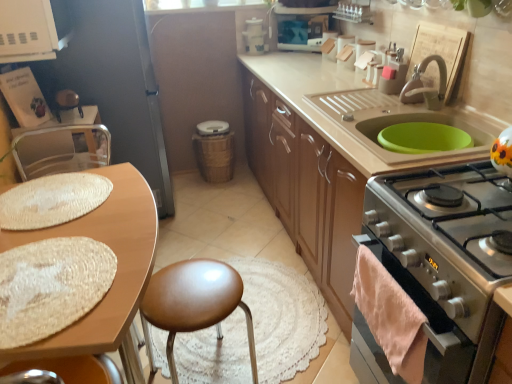
What do you see at coordinates (214, 150) in the screenshot? I see `woven brown trash can at center, arranged as the second appliance when viewed from the top` at bounding box center [214, 150].

Find the location of a particular element. This screenshot has height=384, width=512. matte wood cabinets at center is located at coordinates [321, 111].

Can you confirm if metallic silver chair at left is smaller than white plastic container at upper center, which is the first appliance in top-to-bottom order?

No, metallic silver chair at left is not smaller than white plastic container at upper center, which is the first appliance in top-to-bottom order.

Considering the relative positions of metallic silver chair at left and white plastic container at upper center, which is the first appliance in top-to-bottom order, in the image provided, is metallic silver chair at left to the right of white plastic container at upper center, which is the first appliance in top-to-bottom order, from the viewer's perspective?

No, metallic silver chair at left is not to the right of white plastic container at upper center, which is the first appliance in top-to-bottom order.

Based on the photo, is metallic silver chair at left aimed at white plastic container at upper center, which is the 1th appliance in right-to-left order?

No, metallic silver chair at left is not oriented towards white plastic container at upper center, which is the 1th appliance in right-to-left order.

Is metallic silver chair at left facing towards woven brown trash can at center, arranged as the second appliance when viewed from the top?

No, metallic silver chair at left does not turn towards woven brown trash can at center, arranged as the second appliance when viewed from the top.

Find the location of a particular element. appliance located underneath the metallic silver chair at left (from a real-world perspective) is located at coordinates (214, 150).

From a real-world perspective, is metallic silver chair at left above or below woven brown trash can at center, which appears as the second appliance when viewed from the front?

In terms of real-world spatial position, metallic silver chair at left is above woven brown trash can at center, which appears as the second appliance when viewed from the front.

Is metallic silver chair at left wider or thinner than woven brown trash can at center, arranged as the second appliance when viewed from the right?

metallic silver chair at left is thinner than woven brown trash can at center, arranged as the second appliance when viewed from the right.

Between point (426, 161) and point (248, 23), which one is positioned behind?

The point (248, 23) is farther from the camera.

From the matte wood cabinets at center, count 1st appliances backward and point to it. Please provide its 2D coordinates.

[(254, 37)]

Is matte wood cabinets at center outside of white plastic container at upper center, the 1th appliance in the front-to-back sequence?

That's correct, matte wood cabinets at center is outside of white plastic container at upper center, the 1th appliance in the front-to-back sequence.

Is matte wood cabinets at center in front of or behind white plastic container at upper center, which is counted as the second appliance, starting from the bottom, in the image?

In the image, matte wood cabinets at center appears in front of white plastic container at upper center, which is counted as the second appliance, starting from the bottom.

Find the location of a particular element. bar stool directly beneath the wooden table at left (from a real-world perspective) is located at coordinates (193, 303).

Does wooden table at left appear on the right side of brown leather stool at center?

No.

Is brown leather stool at center at the back of wooden table at left?

wooden table at left is not turned away from brown leather stool at center.

From the image's perspective, is wooden table at left located above matte wood cabinets at center?

Actually, wooden table at left appears below matte wood cabinets at center in the image.

From a real-world perspective, between wooden table at left and matte wood cabinets at center, who is vertically higher?

matte wood cabinets at center is physically above.

Is wooden table at left turned away from matte wood cabinets at center?

No, wooden table at left's orientation is not away from matte wood cabinets at center.

This screenshot has height=384, width=512. What are the coordinates of `table that is on the left side of matte wood cabinets at center` in the screenshot? It's located at (115, 276).

From a real-world perspective, is metallic silver chair at left under green rubber mat at upper right?

Yes, from a real-world perspective, metallic silver chair at left is beneath green rubber mat at upper right.

Considering the positions of objects metallic silver chair at left and green rubber mat at upper right in the image provided, who is in front, metallic silver chair at left or green rubber mat at upper right?

green rubber mat at upper right is more forward.

The height and width of the screenshot is (384, 512). Identify the location of sink that is above the metallic silver chair at left (from the image's perspective). (392, 122).

Can you confirm if metallic silver chair at left is positioned to the left of green rubber mat at upper right?

Yes.

From the image's perspective, does wooden table at left appear higher than satin silver oven at lower right?

Yes, from the image's perspective, wooden table at left is over satin silver oven at lower right.

Considering the relative sizes of wooden table at left and satin silver oven at lower right in the image provided, is wooden table at left bigger than satin silver oven at lower right?

Indeed, wooden table at left has a larger size compared to satin silver oven at lower right.

Can we say wooden table at left lies outside satin silver oven at lower right?

Yes, wooden table at left is located beyond the bounds of satin silver oven at lower right.

You are a GUI agent. You are given a task and a screenshot of the screen. Output one action in this format:
    pyautogui.click(x=<x>, y=<y>)
    Task: Click on the chair on the left of white plastic container at upper center, which is counted as the second appliance, starting from the bottom
    
    Given the screenshot: What is the action you would take?
    click(x=61, y=150)

This screenshot has width=512, height=384. Find the location of `appliance below the metallic silver chair at left (from a real-world perspective)`. appliance below the metallic silver chair at left (from a real-world perspective) is located at coordinates (214, 150).

Which object lies further to the anchor point satin silver oven at lower right, metallic silver chair at left or matte wood cabinets at center?

metallic silver chair at left is further to satin silver oven at lower right.

Looking at the image, which one is located further to green rubber mat at upper right, metallic silver chair at left or pink fluffy towel at lower right?

Based on the image, metallic silver chair at left appears to be further to green rubber mat at upper right.

Based on their spatial positions, is woven brown trash can at center, arranged as the second appliance when viewed from the right, or brown leather stool at center closer to pink fluffy towel at lower right?

Among the two, brown leather stool at center is located nearer to pink fluffy towel at lower right.

From the image, which object appears to be nearer to pink fluffy towel at lower right, matte wood cabinets at center or metallic silver chair at left?

matte wood cabinets at center is positioned closer to the anchor pink fluffy towel at lower right.

Looking at this image, which object lies nearer to the anchor point brown leather stool at center, metallic silver chair at left or wooden table at left?

The object closer to brown leather stool at center is wooden table at left.

Looking at this image, when comparing their distances from pink fluffy towel at lower right, does white plastic container at upper center, which is the 1th appliance in right-to-left order, or brown leather stool at center seem closer?

brown leather stool at center is positioned closer to the anchor pink fluffy towel at lower right.

Considering their positions, is green rubber mat at upper right positioned closer to metallic silver chair at left than matte wood cabinets at center?

matte wood cabinets at center lies closer to metallic silver chair at left than the other object.

From the picture: When comparing their distances from pink fluffy towel at lower right, does metallic silver chair at left or matte wood cabinets at center seem further?

metallic silver chair at left is further to pink fluffy towel at lower right.

I want to click on kitchen appliance located between wooden table at left and woven brown trash can at center, which is the 1th appliance from back to front, in the depth direction, so click(x=446, y=258).

Where is `material between wooden table at left and satin silver oven at lower right`? material between wooden table at left and satin silver oven at lower right is located at coordinates (390, 316).

Identify the location of bar stool between matte wood cabinets at center and white plastic container at upper center, which is counted as the second appliance, starting from the bottom, from front to back. (193, 303).

I want to click on cabinetry situated between brown leather stool at center and satin silver oven at lower right from left to right, so click(x=321, y=111).